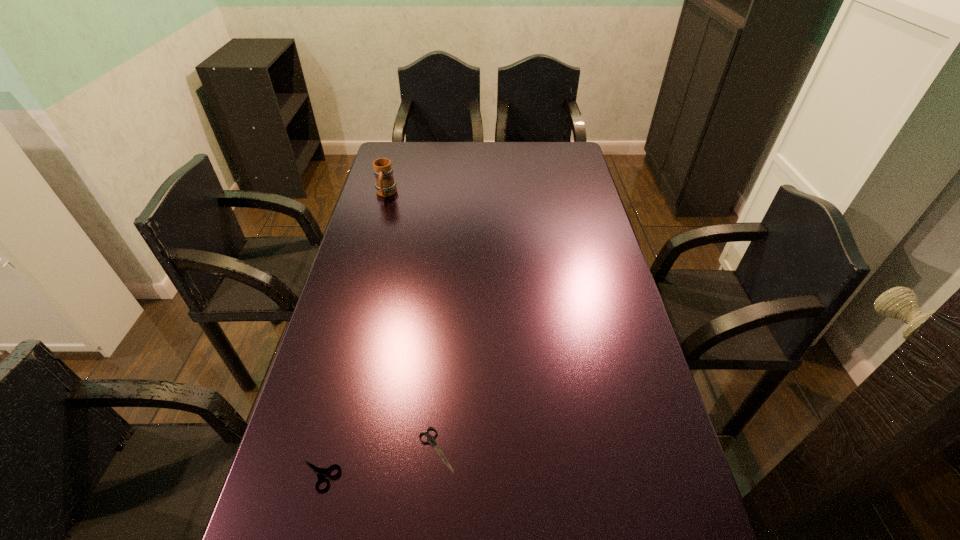
Identify the location of shears situated at the left edge. This screenshot has width=960, height=540. (320, 472).

In the image, there is a desktop. Identify the location of vacant space at the far edge. (431, 161).

Locate an element on the screen. This screenshot has height=540, width=960. free space at the left edge is located at coordinates (371, 316).

Locate an element on the screen. Image resolution: width=960 pixels, height=540 pixels. free spot at the far right corner of the desktop is located at coordinates (559, 148).

Where is `free space between the farthest object and the left shears`? This screenshot has height=540, width=960. free space between the farthest object and the left shears is located at coordinates (353, 335).

Where is `blank region between the farthest object and the right shears`? blank region between the farthest object and the right shears is located at coordinates (411, 321).

The height and width of the screenshot is (540, 960). I want to click on vacant space that is in between the farthest object and the rightmost object, so click(411, 321).

Find the location of a particular element. This screenshot has width=960, height=540. vacant area that lies between the left shears and the rightmost object is located at coordinates point(378,463).

The width and height of the screenshot is (960, 540). I want to click on free area in between the taller shears and the rightmost object, so click(x=378, y=463).

Image resolution: width=960 pixels, height=540 pixels. What are the coordinates of `free space that is in between the taller shears and the shortest object` in the screenshot? It's located at (378, 463).